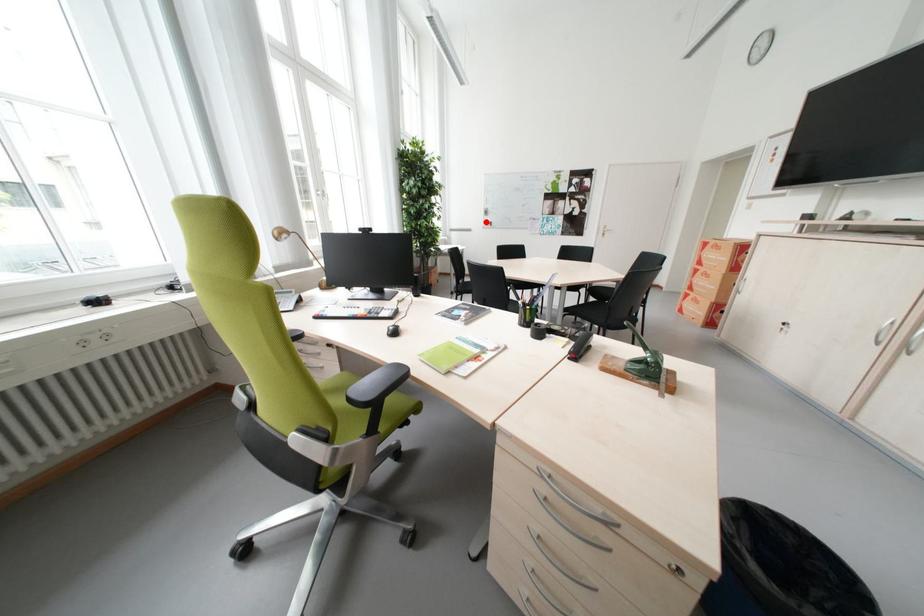
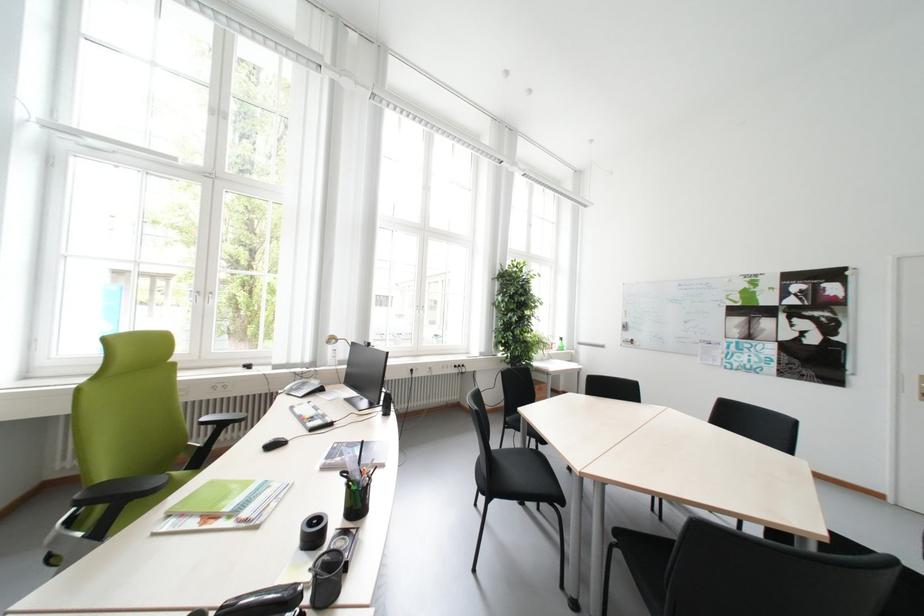
Question: I am providing you with two images of the same scene from different viewpoints. Image1 has a red point marked. In image2, the corresponding 3D location appears at what relative position? Reply with the corresponding letter.

Choices:
 (A) Closer
 (B) Farther

Answer: (B)